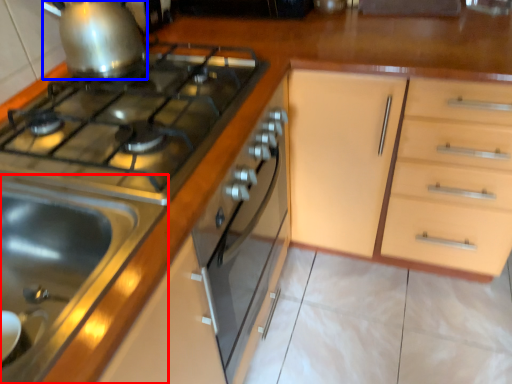
Question: Which point is closer to the camera, sink (highlighted by a red box) or kitchen appliance (highlighted by a blue box)?

Choices:
 (A) sink
 (B) kitchen appliance

Answer: (A)